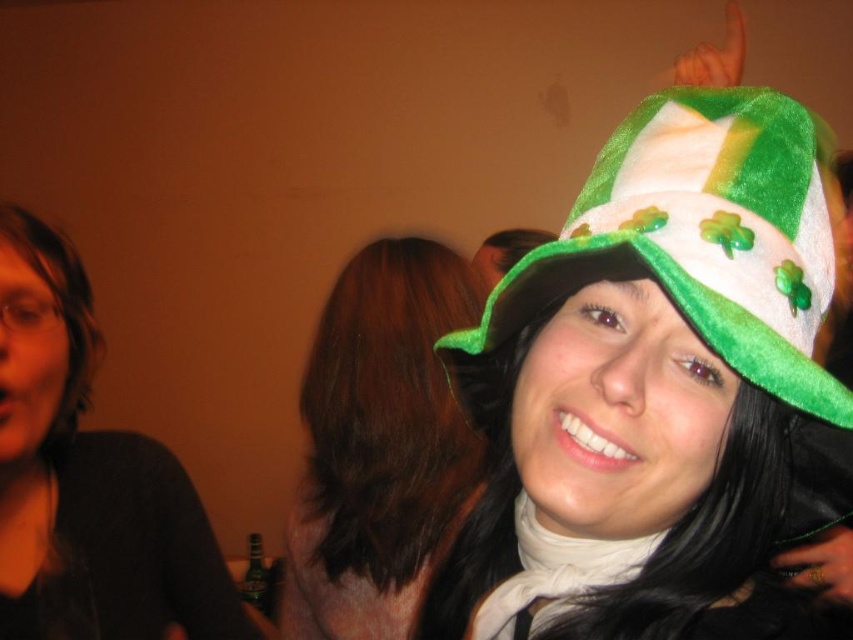
You are standing in a room and see a point at coordinate point (807,276). If you want to place a 16 inch wide decoration on the wall, will it fit without overlapping the point?

The point at coordinate point (807,276) is 15.77 inches from the viewer. Since the decoration is 16 inches wide, it will overlap the point as it requires more space than available.

You are at a St. Patrick Day party and want to find the taller green fuzzy hat. Which one between the green fuzzy hat at upper right and the green fuzzy hat at upper center should you look for?

The green fuzzy hat at upper center is taller than the green fuzzy hat at upper right, so you should look for the green fuzzy hat at upper center.